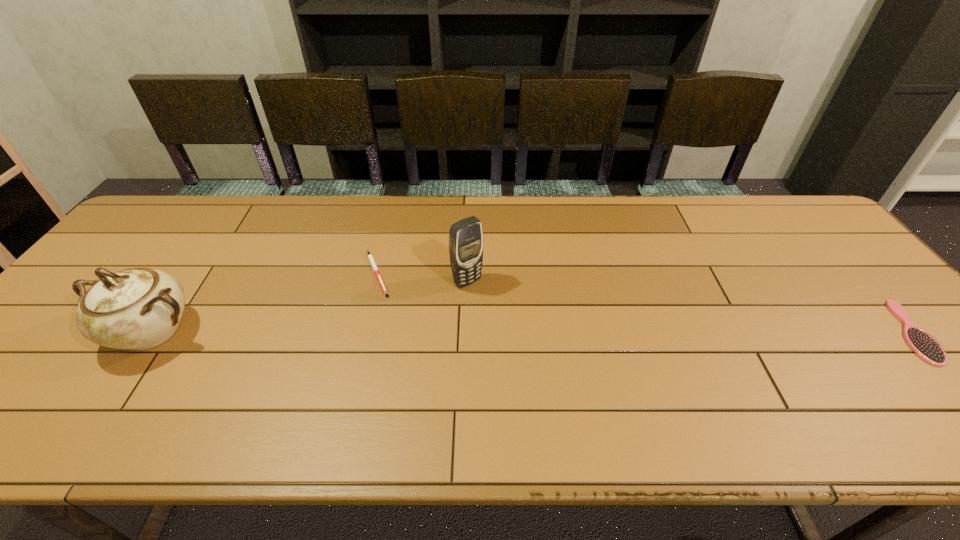
Locate an element on the screen. The width and height of the screenshot is (960, 540). free location located on the clicker of the pen is located at coordinates (411, 299).

Find the location of a particular element. free spot located 0.210m on the front face of the third object from left to right is located at coordinates (526, 341).

Find the location of `free space located 0.150m on the front face of the third object from left to right`. free space located 0.150m on the front face of the third object from left to right is located at coordinates (511, 325).

This screenshot has height=540, width=960. Identify the location of vacant space located 0.220m on the front face of the third object from left to right. (528, 344).

This screenshot has width=960, height=540. Identify the location of chinaware present at the near edge. (139, 308).

Where is `hairbrush positioned at the near edge`? The image size is (960, 540). hairbrush positioned at the near edge is located at coordinates (926, 347).

The width and height of the screenshot is (960, 540). Identify the location of object that is at the left edge. (139, 308).

You are a GUI agent. You are given a task and a screenshot of the screen. Output one action in this format:
    pyautogui.click(x=<x>, y=<y>)
    Task: Click on the object that is at the right edge
    
    Given the screenshot: What is the action you would take?
    pyautogui.click(x=926, y=347)

Where is `object that is at the near left corner`? The image size is (960, 540). object that is at the near left corner is located at coordinates (139, 308).

Locate an element on the screen. object that is at the near right corner is located at coordinates (926, 347).